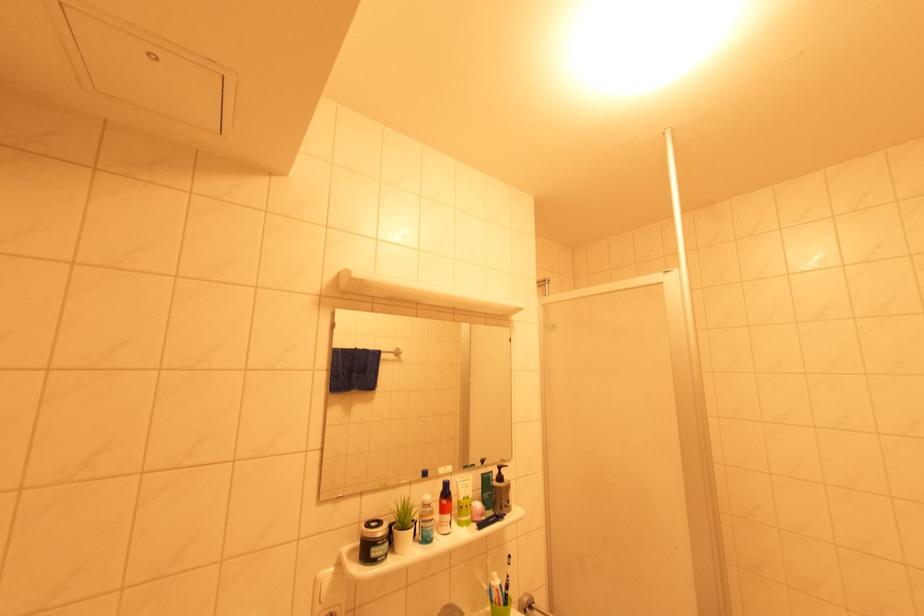
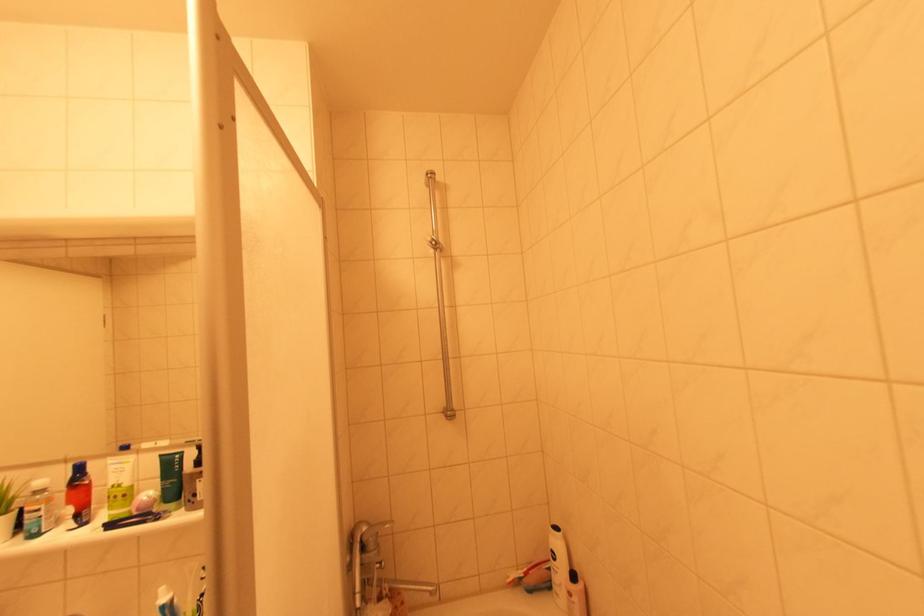
What movement of the cameraman would produce the second image?

The movement direction of the cameraman is right, forward.